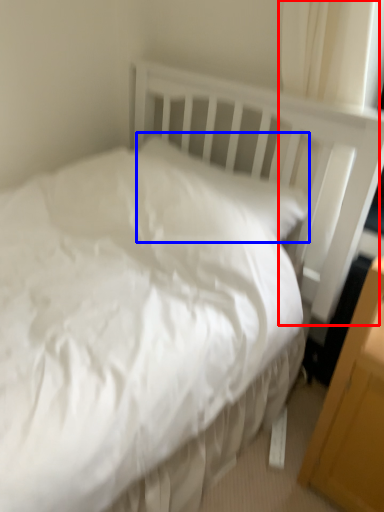
Question: Which object is further to the camera taking this photo, curtain (highlighted by a red box) or pillow (highlighted by a blue box)?

Choices:
 (A) curtain
 (B) pillow

Answer: (B)